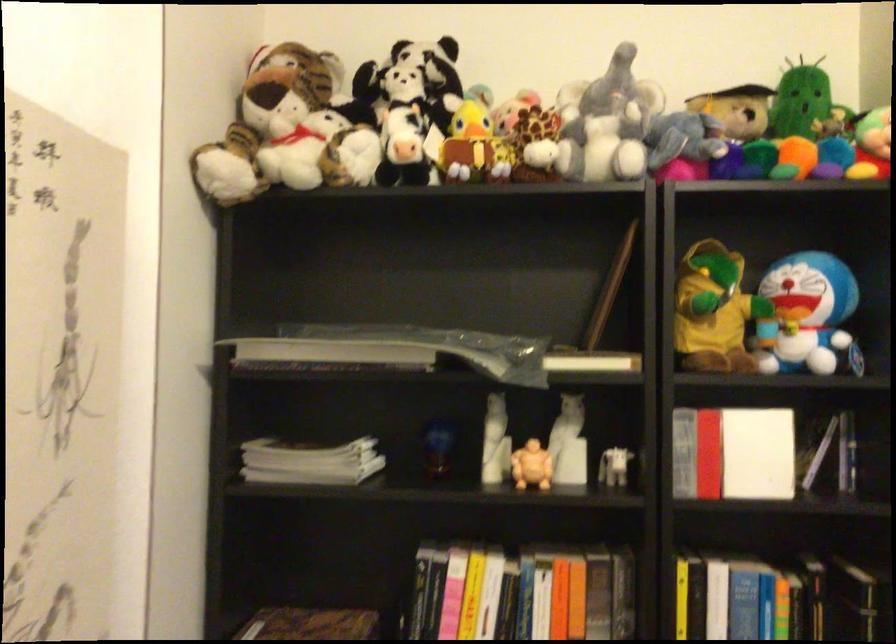
Find where to lift the stuffed panda toy. Please return your answer as a coordinate pair (x, y).

(410, 79)